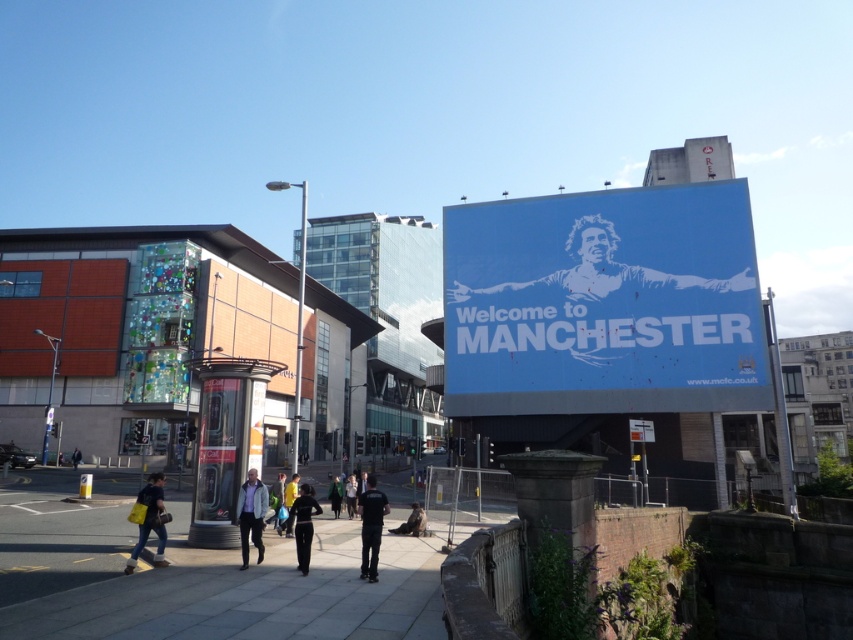
Does point (189, 630) lie in front of point (421, 512)?

Yes, it is.

Describe the element at coordinates (251, 593) in the screenshot. Image resolution: width=853 pixels, height=640 pixels. I see `smooth concrete pavement at center` at that location.

Which is behind, point (421, 600) or point (409, 520)?

The point (409, 520) is more distant.

I want to click on smooth concrete pavement at center, so click(x=251, y=593).

Which is below, light gray jacket at center or green fabric jacket at center?

green fabric jacket at center

Does light gray jacket at center have a greater height compared to green fabric jacket at center?

In fact, light gray jacket at center may be shorter than green fabric jacket at center.

Who is more forward, [259,520] or [277,499]?

Positioned in front is point [259,520].

Where is `light gray jacket at center`? The height and width of the screenshot is (640, 853). light gray jacket at center is located at coordinates (251, 515).

Is brown leather jacket at lower center above yellow fabric at center?

Incorrect, brown leather jacket at lower center is not positioned above yellow fabric at center.

Identify the location of brown leather jacket at lower center. This screenshot has width=853, height=640. (412, 522).